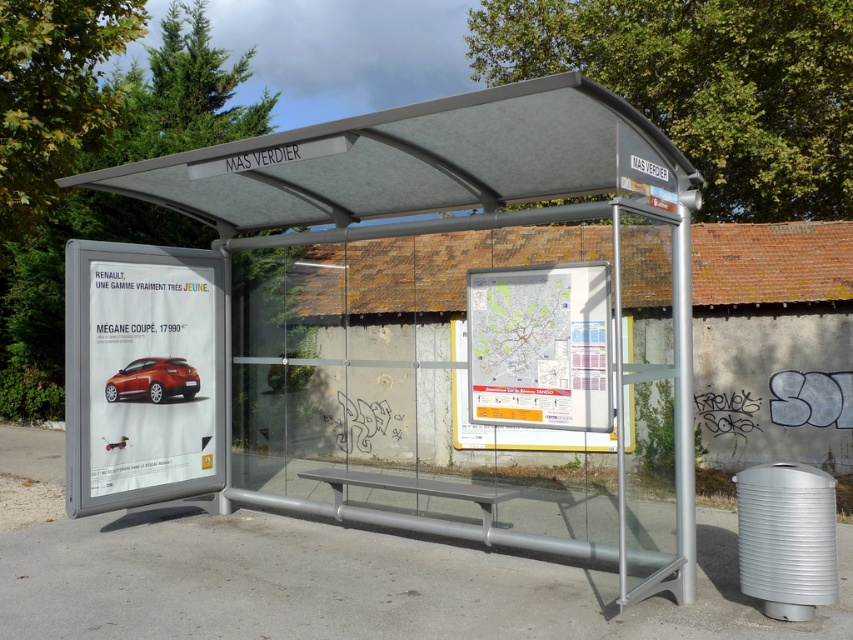
Does matte red car at left have a larger size compared to matte plastic map at center?

Correct, matte red car at left is larger in size than matte plastic map at center.

Can you confirm if matte red car at left is smaller than matte plastic map at center?

No, matte red car at left is not smaller than matte plastic map at center.

Does point (132, 326) come closer to viewer compared to point (544, 387)?

That is False.

This screenshot has height=640, width=853. I want to click on matte red car at left, so click(149, 374).

Which is more to the left, matte gray canopy at center or matte red car at left?

From the viewer's perspective, matte red car at left appears more on the left side.

From the picture: Does matte gray canopy at center have a larger size compared to matte red car at left?

Yes, matte gray canopy at center is bigger than matte red car at left.

Which is in front, point (564, 99) or point (135, 433)?

Point (564, 99)

Locate an element on the screen. This screenshot has width=853, height=640. matte gray canopy at center is located at coordinates (416, 161).

Can you confirm if metallic silver bus station at center is wider than shiny red car at center?

Yes, metallic silver bus station at center is wider than shiny red car at center.

Is point (490, 163) positioned before point (134, 396)?

Yes, it is.

This screenshot has height=640, width=853. Describe the element at coordinates (448, 205) in the screenshot. I see `metallic silver bus station at center` at that location.

Where is `metallic silver bus station at center`? metallic silver bus station at center is located at coordinates (448, 205).